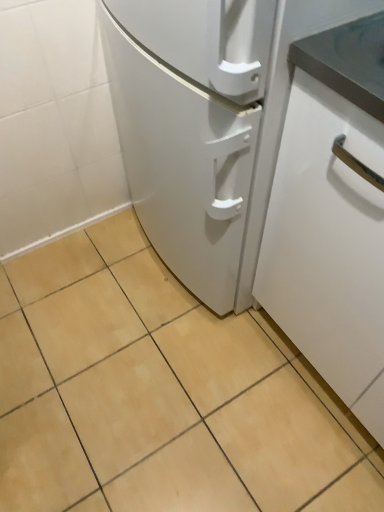
Question: Which is correct: white matte cabinet at right is inside beige ceramic tile at center, or outside of it?

Choices:
 (A) inside
 (B) outside

Answer: (B)

Question: From a real-world perspective, relative to beige ceramic tile at center, is white matte cabinet at right vertically above or below?

Choices:
 (A) below
 (B) above

Answer: (B)

Question: In terms of width, does white matte cabinet at right look wider or thinner when compared to beige ceramic tile at center?

Choices:
 (A) wide
 (B) thin

Answer: (B)

Question: From the image's perspective, is beige ceramic tile at center above or below white matte cabinet at right?

Choices:
 (A) below
 (B) above

Answer: (A)

Question: Considering their positions, is beige ceramic tile at center located in front of or behind white matte cabinet at right?

Choices:
 (A) front
 (B) behind

Answer: (B)

Question: Does point (135, 417) appear closer or farther from the camera than point (362, 212)?

Choices:
 (A) closer
 (B) farther

Answer: (B)

Question: In terms of height, does beige ceramic tile at center look taller or shorter compared to white matte cabinet at right?

Choices:
 (A) tall
 (B) short

Answer: (B)